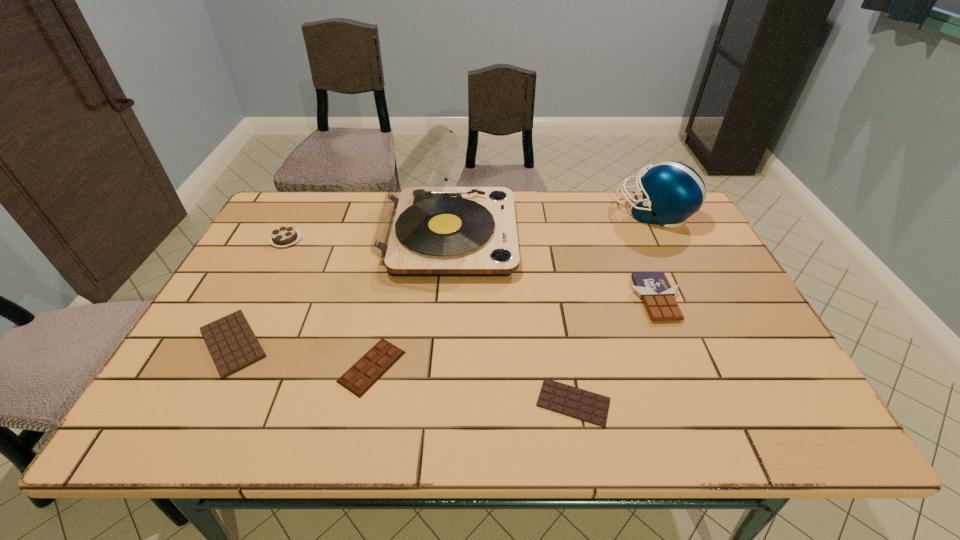
Locate an element on the screen. vacant space located 0.390m with the tonearm facing the front of the tallest object is located at coordinates (645, 235).

What are the coordinates of `blank space located 0.320m at the front of the football helmet with the faceguard` in the screenshot? It's located at (516, 213).

At what (x,y) coordinates should I click in order to perform the action: click on free space located at the front of the football helmet with the faceguard. Please return your answer as a coordinate pair (x, y). Looking at the image, I should click on (568, 213).

You are a GUI agent. You are given a task and a screenshot of the screen. Output one action in this format:
    pyautogui.click(x=<x>, y=<y>)
    Task: Click on the free point located 0.290m at the front of the football helmet with the faceguard
    The height and width of the screenshot is (540, 960).
    Given the screenshot: What is the action you would take?
    pyautogui.click(x=525, y=213)

What are the coordinates of `free spot located on the right of the chocolate cake` in the screenshot? It's located at (x=403, y=240).

This screenshot has height=540, width=960. I want to click on free region located 0.270m on the left of the rightmost chocolate bar, so point(526,299).

Identify the location of blank space located 0.280m on the right of the third shortest chocolate bar. The width and height of the screenshot is (960, 540). (531, 367).

The width and height of the screenshot is (960, 540). Identify the location of free space located on the right of the leftmost chocolate bar. (394, 343).

The height and width of the screenshot is (540, 960). What are the coordinates of `free space located on the right of the shortest object` in the screenshot? It's located at (660, 402).

Find the location of a particular element. Image resolution: width=960 pixels, height=540 pixels. record player that is at the far edge is located at coordinates (424, 229).